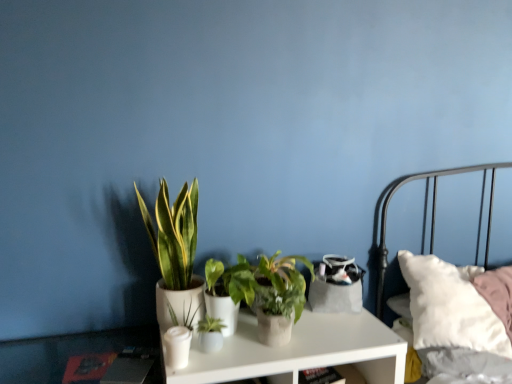
Question: Is green matte plant at center, the 2th houseplant when ordered from left to right, to the right of white matte nightstand at center from the viewer's perspective?

Choices:
 (A) yes
 (B) no

Answer: (B)

Question: From the image's perspective, is green matte plant at center, the 2th houseplant when ordered from left to right, located above white matte nightstand at center?

Choices:
 (A) yes
 (B) no

Answer: (A)

Question: Could you tell me if green matte plant at center, which ranks as the 3th houseplant in right-to-left order, is turned towards white matte nightstand at center?

Choices:
 (A) no
 (B) yes

Answer: (A)

Question: Does green matte plant at center, the 2th houseplant when ordered from left to right, have a lesser height compared to white matte nightstand at center?

Choices:
 (A) no
 (B) yes

Answer: (B)

Question: Is white matte nightstand at center at the back of green matte plant at center, which ranks as the 3th houseplant in right-to-left order?

Choices:
 (A) no
 (B) yes

Answer: (A)

Question: Is green matte plant at center, the 2th houseplant when ordered from left to right, thinner than white matte nightstand at center?

Choices:
 (A) yes
 (B) no

Answer: (A)

Question: Would you consider green matte plant at center, which ranks as the 3th houseplant in right-to-left order, to be distant from green glossy plant at center, which ranks as the first houseplant in left-to-right order?

Choices:
 (A) no
 (B) yes

Answer: (A)

Question: Considering the relative sizes of green matte plant at center, which ranks as the 3th houseplant in right-to-left order, and green glossy plant at center, which ranks as the first houseplant in left-to-right order, in the image provided, is green matte plant at center, which ranks as the 3th houseplant in right-to-left order, smaller than green glossy plant at center, which ranks as the first houseplant in left-to-right order,?

Choices:
 (A) yes
 (B) no

Answer: (A)

Question: Does green matte plant at center, the 2th houseplant when ordered from left to right, lie in front of green glossy plant at center, which is the 4th houseplant in right-to-left order?

Choices:
 (A) yes
 (B) no

Answer: (B)

Question: Is green matte plant at center, the 2th houseplant when ordered from left to right, positioned beyond the bounds of green glossy plant at center, which ranks as the first houseplant in left-to-right order?

Choices:
 (A) yes
 (B) no

Answer: (A)

Question: From a real-world perspective, is green matte plant at center, which ranks as the 3th houseplant in right-to-left order, located beneath green glossy plant at center, which ranks as the first houseplant in left-to-right order?

Choices:
 (A) yes
 (B) no

Answer: (A)

Question: Does green matte plant at center, the 2th houseplant when ordered from left to right, have a lesser height compared to green glossy plant at center, which ranks as the first houseplant in left-to-right order?

Choices:
 (A) no
 (B) yes

Answer: (B)

Question: Does green matte plant at center, the 2th houseplant when ordered from left to right, lie in front of green matte plant at center, which is the 4th houseplant from left to right?

Choices:
 (A) yes
 (B) no

Answer: (A)